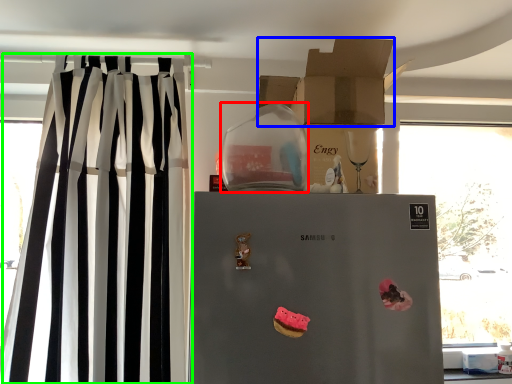
Question: Estimate the real-world distances between objects in this image. Which object is closer to appliance (highlighted by a red box), cardboard box (highlighted by a blue box) or curtain (highlighted by a green box)?

Choices:
 (A) cardboard box
 (B) curtain

Answer: (A)